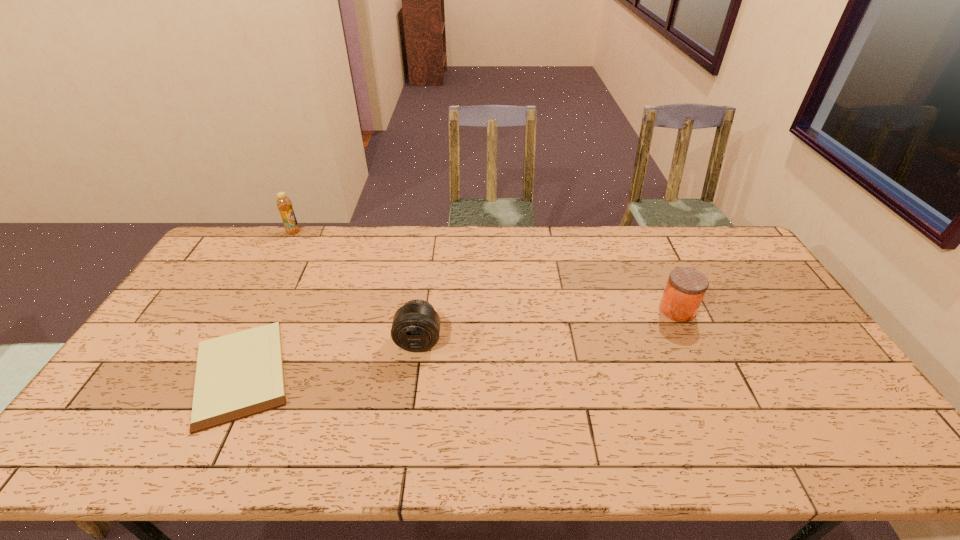
Find the location of a particular element. free space at the near right corner of the desktop is located at coordinates (876, 450).

What are the coordinates of `vacant space that is in between the second object from right to left and the tallest object` in the screenshot? It's located at (356, 286).

Where is `free space between the second farthest object and the bottle`? Image resolution: width=960 pixels, height=540 pixels. free space between the second farthest object and the bottle is located at coordinates (485, 271).

Locate an element on the screen. This screenshot has height=540, width=960. empty space between the bottle and the third object from left to right is located at coordinates (356, 286).

Where is `vacant area that lies between the telephoto lens and the jar`? This screenshot has width=960, height=540. vacant area that lies between the telephoto lens and the jar is located at coordinates (548, 326).

In order to click on blank region between the clipboard and the telephoto lens in this screenshot , I will do `click(329, 357)`.

The width and height of the screenshot is (960, 540). I want to click on empty space between the farthest object and the telephoto lens, so click(x=356, y=286).

Where is `vacant space that's between the jar and the tallest object`? This screenshot has height=540, width=960. vacant space that's between the jar and the tallest object is located at coordinates (485, 271).

The image size is (960, 540). Identify the location of vacant region between the bottle and the jar. (485, 271).

Locate an element on the screen. vacant area that lies between the third nearest object and the clipboard is located at coordinates (459, 341).